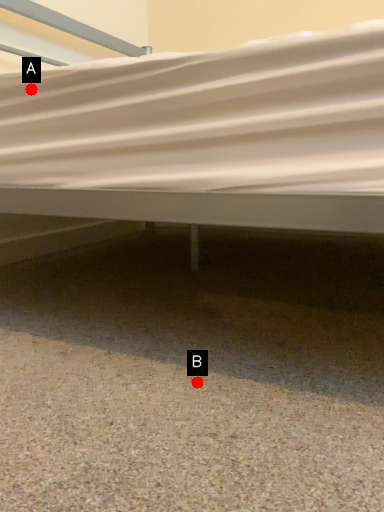
Question: Two points are circled on the image, labeled by A and B beside each circle. Which point appears closest to the camera in this image?

Choices:
 (A) A is closer
 (B) B is closer

Answer: (B)